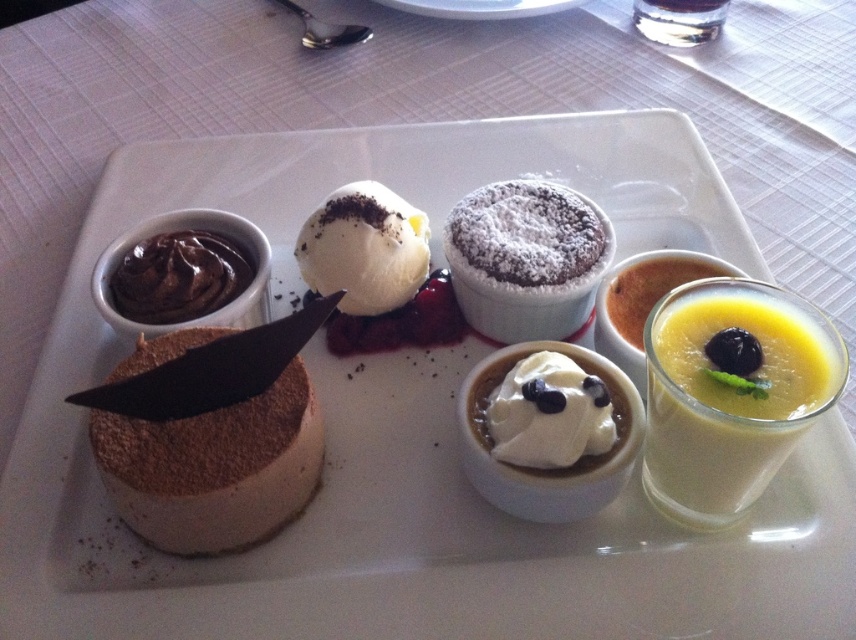
Is white creamy ice cream at center below smooth chocolate pudding at upper left?

No.

Is point (369, 209) positioned before point (229, 246)?

Yes, it is in front of point (229, 246).

This screenshot has width=856, height=640. I want to click on white creamy ice cream at center, so click(x=364, y=248).

Which is above, powdered chocolate soufflé at center or smooth chocolate pudding at upper left?

powdered chocolate soufflé at center is above.

Can you confirm if powdered chocolate soufflé at center is shorter than smooth chocolate pudding at upper left?

No, powdered chocolate soufflé at center is not shorter than smooth chocolate pudding at upper left.

Is point (522, 282) positioned in front of point (176, 316)?

No, it is not.

Identify the location of powdered chocolate soufflé at center. (526, 259).

Is yellow creamy pudding at lower right behind whipped cream topped pudding at center?

No, yellow creamy pudding at lower right is in front of whipped cream topped pudding at center.

Is yellow creamy pudding at lower right above whipped cream topped pudding at center?

Correct, yellow creamy pudding at lower right is located above whipped cream topped pudding at center.

Where is `yellow creamy pudding at lower right`? Image resolution: width=856 pixels, height=640 pixels. yellow creamy pudding at lower right is located at coordinates (721, 417).